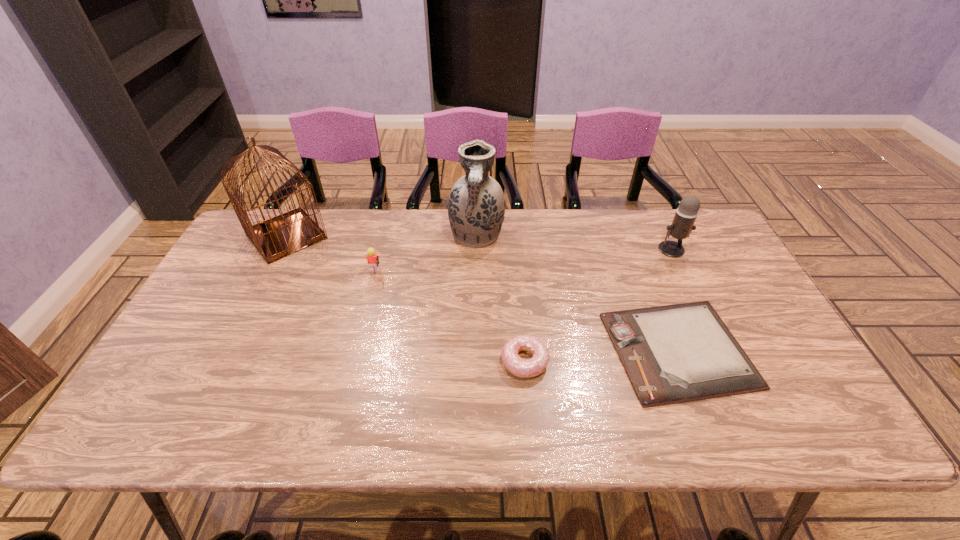
At what (x,y) coordinates should I click in order to perform the action: click on free location located in front of the fourth tallest object with the accessory visible. Please return your answer as a coordinate pair (x, y). Image resolution: width=960 pixels, height=540 pixels. Looking at the image, I should click on (450, 273).

Where is `vacant area situated on the left of the doughnut`? The image size is (960, 540). vacant area situated on the left of the doughnut is located at coordinates (476, 361).

Locate an element on the screen. The width and height of the screenshot is (960, 540). free space located 0.230m on the back of the clipboard is located at coordinates (637, 249).

Identify the location of birdcage that is at the far edge. Image resolution: width=960 pixels, height=540 pixels. (x=282, y=235).

This screenshot has height=540, width=960. In order to click on vase situated at the far edge in this screenshot , I will do `click(476, 205)`.

Find the location of a particular element. This screenshot has width=960, height=540. microphone at the far edge is located at coordinates (682, 225).

Image resolution: width=960 pixels, height=540 pixels. Find the location of `object situated at the near edge`. object situated at the near edge is located at coordinates (677, 353).

This screenshot has height=540, width=960. I want to click on object that is at the left edge, so click(282, 235).

The width and height of the screenshot is (960, 540). Identify the location of microphone located in the right edge section of the desktop. (682, 225).

Where is `clipboard that is at the right edge`? The height and width of the screenshot is (540, 960). clipboard that is at the right edge is located at coordinates (677, 353).